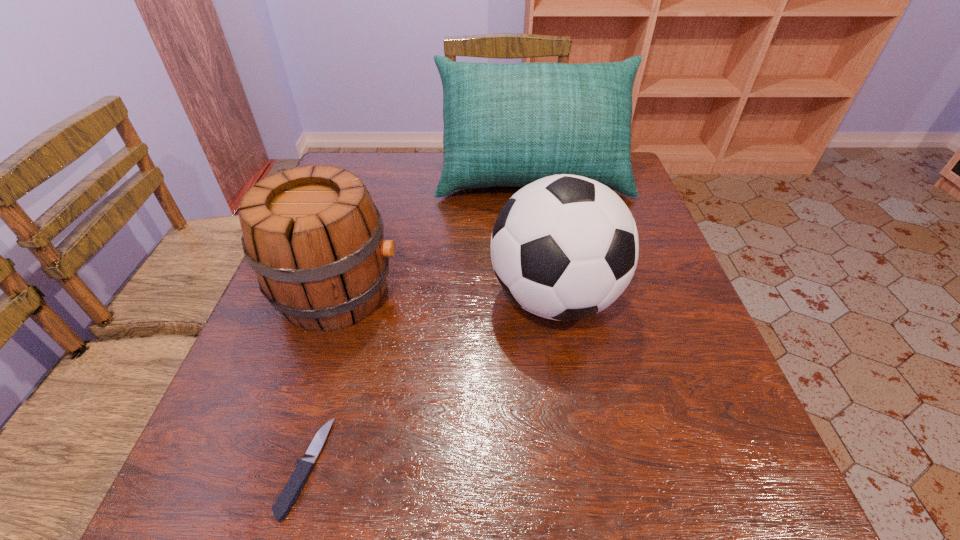
In the image, there is a desktop. Identify the location of free region at the far left corner. Image resolution: width=960 pixels, height=540 pixels. (351, 153).

Locate an element on the screen. blank space at the near left corner is located at coordinates (201, 469).

This screenshot has width=960, height=540. Identify the location of free spot at the near right corner of the desktop. (700, 478).

I want to click on free spot between the cushion and the cider, so click(435, 235).

Find the location of a particular element. The image size is (960, 540). free spot between the nearest object and the cushion is located at coordinates (420, 322).

What are the coordinates of `vacant region between the cider and the soccer ball` in the screenshot? It's located at (446, 295).

The height and width of the screenshot is (540, 960). Find the location of `unoccupied area between the steak knife and the cider`. unoccupied area between the steak knife and the cider is located at coordinates (322, 380).

This screenshot has height=540, width=960. Identify the location of vacant space in between the farthest object and the steak knife. [420, 322].

Find the location of a particular element. This screenshot has width=960, height=540. vacant area that lies between the steak knife and the soccer ball is located at coordinates (430, 382).

Image resolution: width=960 pixels, height=540 pixels. In order to click on free space between the farthest object and the nearest object in this screenshot , I will do `click(420, 322)`.